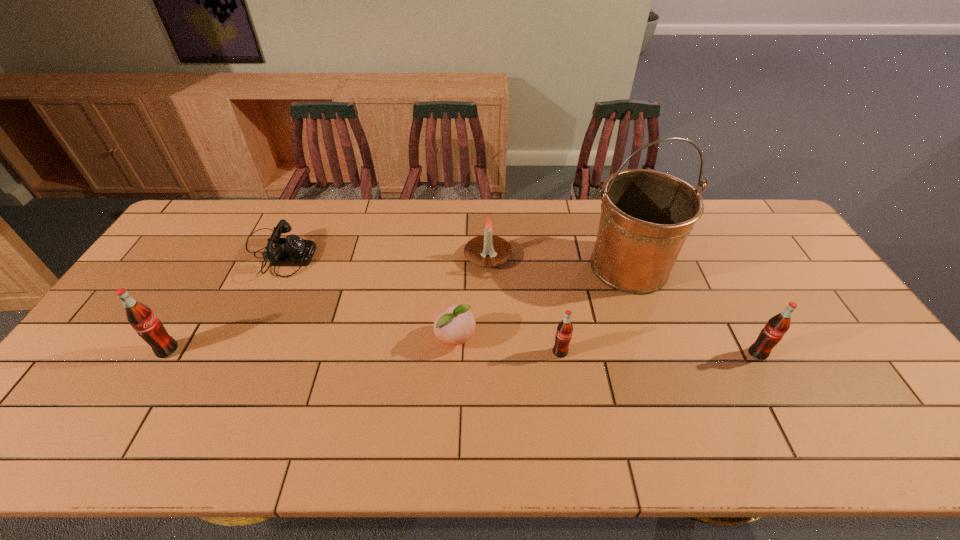
This screenshot has width=960, height=540. I want to click on the sixth tallest object, so click(456, 326).

The image size is (960, 540). I want to click on free region located on the label of the leftmost soda bottle, so (x=105, y=350).

This screenshot has width=960, height=540. Identify the location of free space located 0.080m on the label of the leftmost soda bottle. (128, 350).

This screenshot has width=960, height=540. Find the location of `free region located 0.180m on the label of the leftmost soda bottle`. free region located 0.180m on the label of the leftmost soda bottle is located at coordinates (89, 350).

Where is `blank space located 0.150m on the label of the second soda bottle from left to right`? Image resolution: width=960 pixels, height=540 pixels. blank space located 0.150m on the label of the second soda bottle from left to right is located at coordinates (569, 412).

Locate an element on the screen. This screenshot has width=960, height=540. vacant space located on the label of the rightmost object is located at coordinates (774, 385).

The height and width of the screenshot is (540, 960). I want to click on vacant region located on the front-facing side of the telephone, so click(343, 254).

Image resolution: width=960 pixels, height=540 pixels. I want to click on free space located on the front of the bucket, so coord(675,397).

Find the location of a particular element. This screenshot has width=960, height=540. vacant area situated on the left of the candle is located at coordinates (346, 257).

The height and width of the screenshot is (540, 960). Find the location of `vacant space located on the front of the sixth tallest object`. vacant space located on the front of the sixth tallest object is located at coordinates (453, 397).